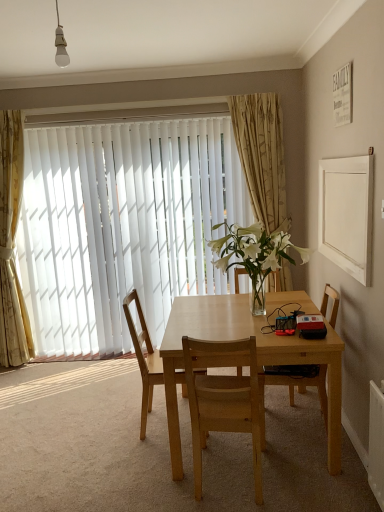
Identify the location of spots to the right of gold textured curtain at left, which is the first curtain in left-to-right order. Image resolution: width=384 pixels, height=512 pixels. (69, 366).